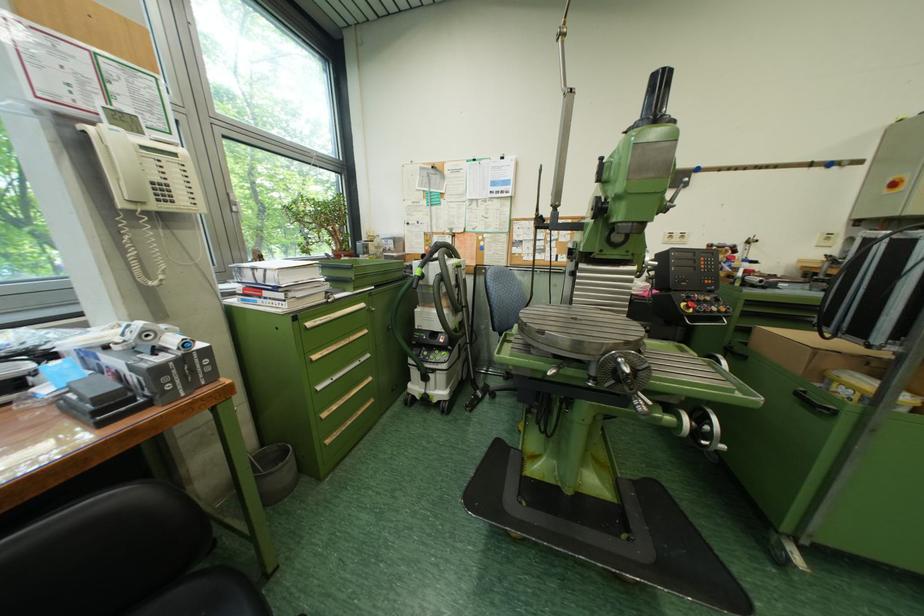
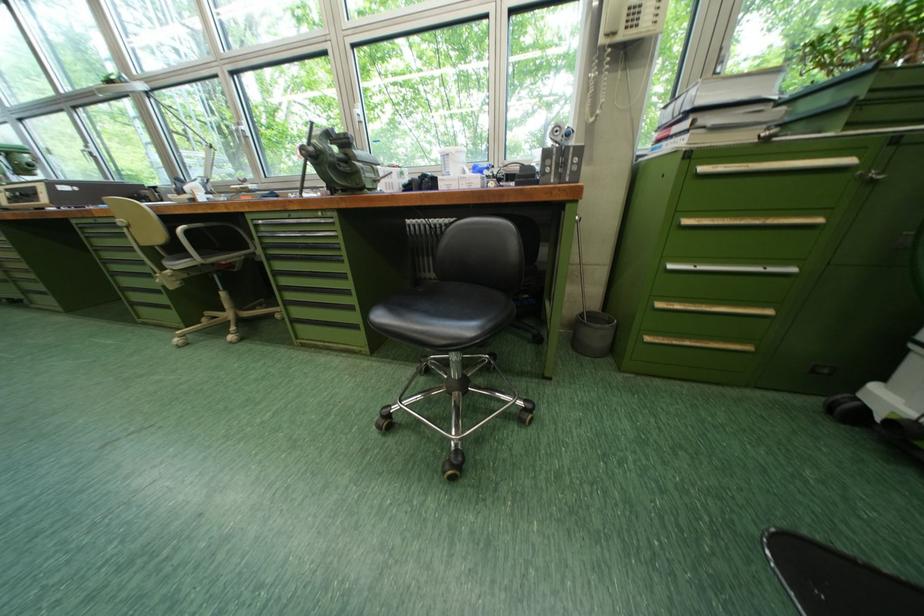
Locate, in the second image, the point that corresponds to [276,296] in the first image.

(686, 132)